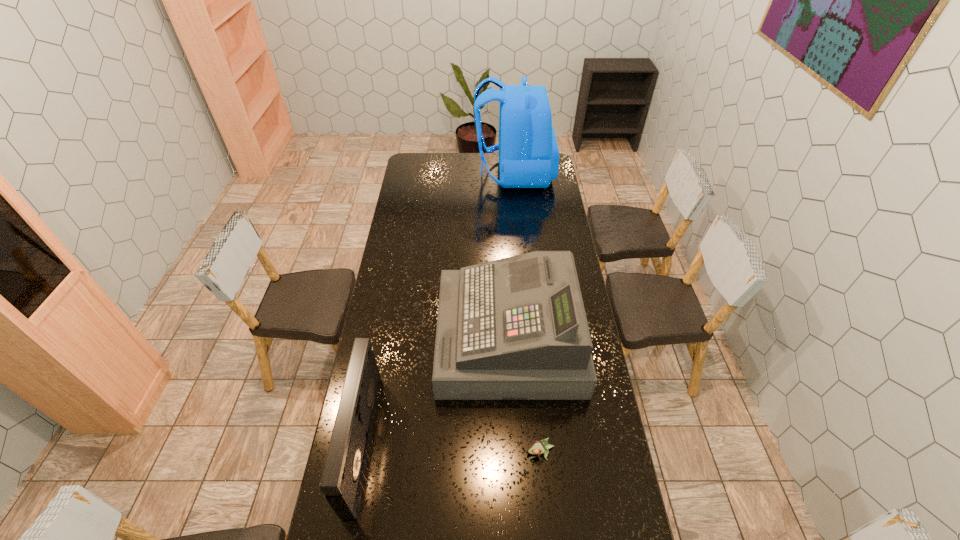
The image size is (960, 540). Identify the location of vacant space at the right edge of the desktop. (537, 228).

This screenshot has height=540, width=960. Find the location of `vacant space at the far left corner of the desktop`. vacant space at the far left corner of the desktop is located at coordinates (413, 156).

At what (x,y) coordinates should I click in order to perform the action: click on free space between the avocado and the third tallest object. Please return your answer as a coordinate pair (x, y). This screenshot has height=540, width=960. Looking at the image, I should click on (451, 447).

I want to click on vacant space that is in between the avocado and the third tallest object, so click(451, 447).

I want to click on free space between the farthest object and the cash register, so [x=512, y=256].

This screenshot has width=960, height=540. What are the coordinates of `object that stands as the third closest to the cash register` in the screenshot? It's located at (528, 151).

What are the coordinates of `object that stands as the third closest to the backpack` in the screenshot? It's located at (537, 447).

Find the location of a particular element. The height and width of the screenshot is (540, 960). free location that satisfies the following two spatial constraints: 1. on the back of the backpack; 2. on the seed side of the avocado is located at coordinates (541, 453).

Identify the location of blank area in the image that satisfies the following two spatial constraints: 1. on the back of the tallest object; 2. on the seed side of the avocado. This screenshot has height=540, width=960. (541, 453).

Where is `vacant area that satisfies the following two spatial constraints: 1. on the back of the farthest object; 2. on the seed side of the avocado`? The image size is (960, 540). vacant area that satisfies the following two spatial constraints: 1. on the back of the farthest object; 2. on the seed side of the avocado is located at coordinates (541, 453).